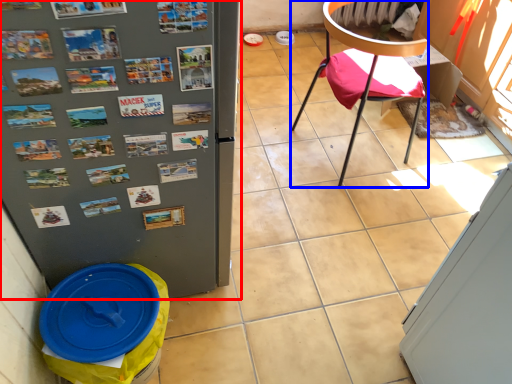
Question: Which object appears farthest to the camera in this image, refrigerator (highlighted by a red box) or chair (highlighted by a blue box)?

Choices:
 (A) refrigerator
 (B) chair

Answer: (B)